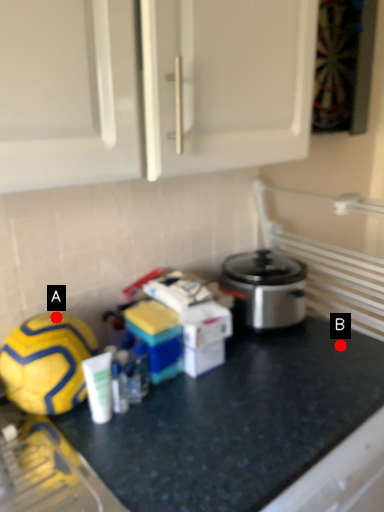
Question: Two points are circled on the image, labeled by A and B beside each circle. Among these points, which one is nearest to the camera?

Choices:
 (A) A is closer
 (B) B is closer

Answer: (A)